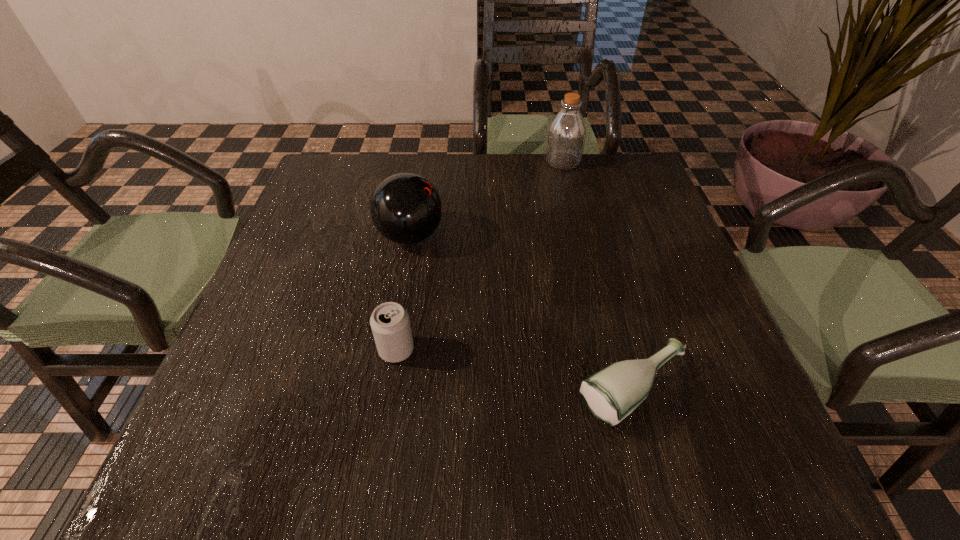
I want to click on object that is the third closest one to the farthest object, so click(390, 324).

Where is `object that is the third closest one to the farther bottle`? object that is the third closest one to the farther bottle is located at coordinates (390, 324).

Find the location of `free space that satisfies the following two spatial constraints: 1. on the surface of the shortest object near the finger holes; 2. on the left side of the third nearest object`. free space that satisfies the following two spatial constraints: 1. on the surface of the shortest object near the finger holes; 2. on the left side of the third nearest object is located at coordinates (384, 391).

At what (x,y) coordinates should I click in order to perform the action: click on free spot that satisfies the following two spatial constraints: 1. on the front side of the shortest object; 2. on the left side of the second shortest object. Please return your answer as a coordinate pair (x, y). This screenshot has height=540, width=960. Looking at the image, I should click on (390, 391).

The height and width of the screenshot is (540, 960). I want to click on free space that satisfies the following two spatial constraints: 1. on the front side of the farther bottle; 2. on the surface of the third nearest object near the finger holes, so click(x=581, y=236).